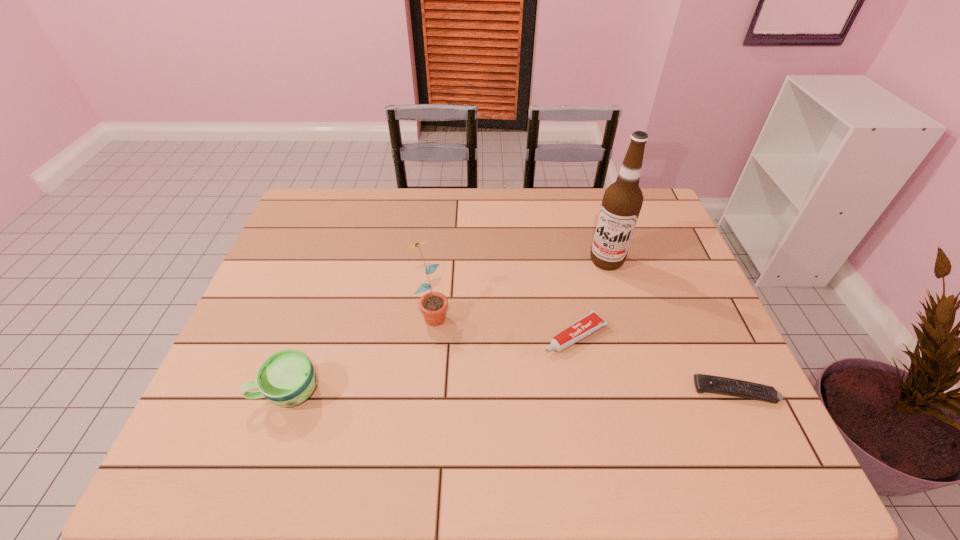
You are a GUI agent. You are given a task and a screenshot of the screen. Output one action in this format:
    pyautogui.click(x=<x>, y=<y>)
    Task: Click on the blank area located 0.210m on the back of the remote control
    Image resolution: width=960 pixels, height=540 pixels.
    Given the screenshot: What is the action you would take?
    tap(698, 309)

Locate an element on the screen. The height and width of the screenshot is (540, 960). free location located at the nozzle of the toothpaste is located at coordinates (522, 365).

Locate an element on the screen. Image resolution: width=960 pixels, height=540 pixels. vacant space located 0.150m at the nozzle of the toothpaste is located at coordinates (502, 377).

Find the location of a particular element. blank space located at the nozzle of the toothpaste is located at coordinates (492, 384).

Image resolution: width=960 pixels, height=540 pixels. In order to click on free region located 0.100m on the label of the alcohol in this screenshot , I will do `click(591, 294)`.

Identify the location of free location located on the label of the alcohol. (595, 285).

Locate an element on the screen. vacant space located 0.330m on the label of the alcohol is located at coordinates (563, 355).

Identify the location of blank space located 0.190m on the flower of the fourth shortest object. (480, 380).

Image resolution: width=960 pixels, height=540 pixels. Find the location of `blank space located 0.150m on the flower of the fourth shortest object`. blank space located 0.150m on the flower of the fourth shortest object is located at coordinates (471, 368).

Find the location of a particular element. vacant area situated 0.280m on the flower of the fourth shortest object is located at coordinates (503, 409).